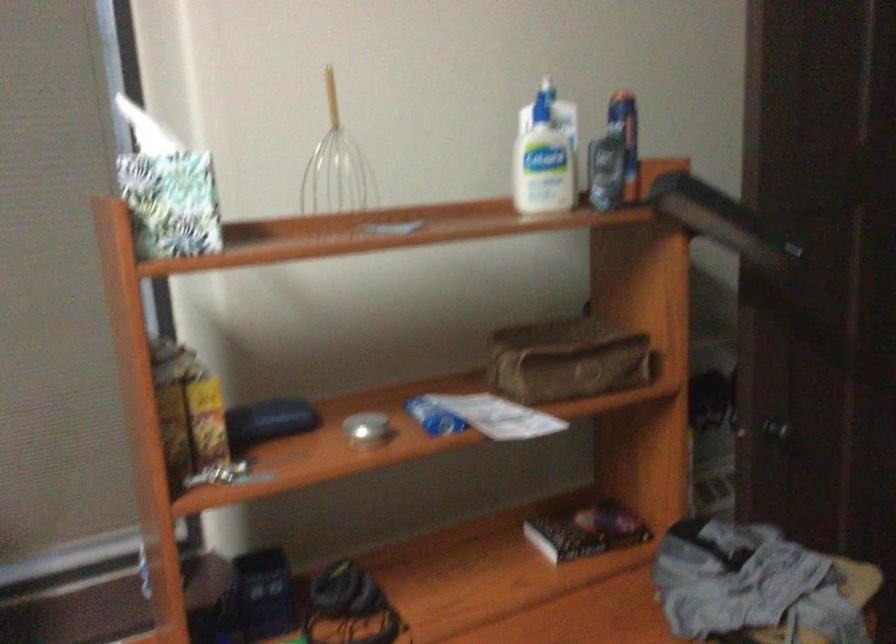
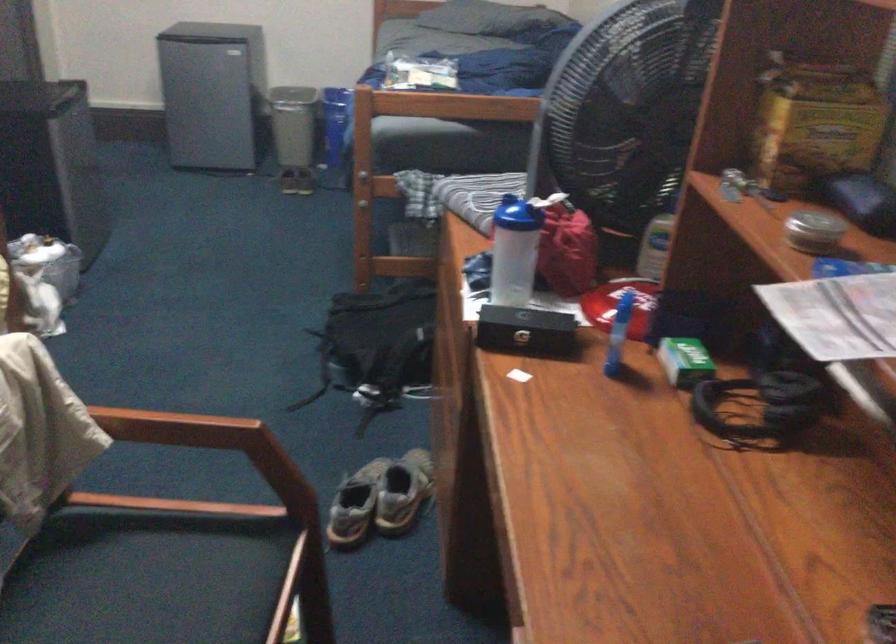
Locate, in the second image, the point that corresponds to (x=358, y=424) in the first image.

(814, 231)